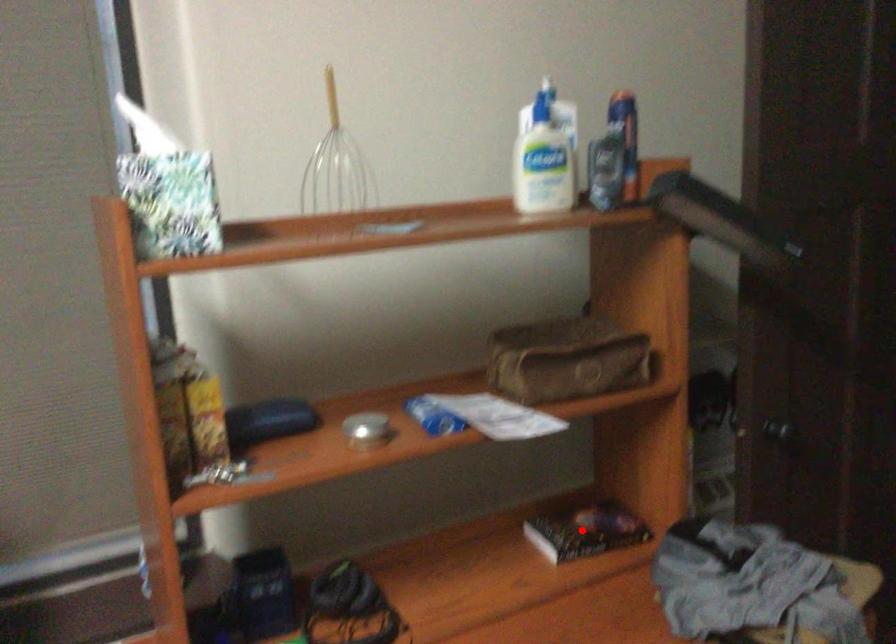
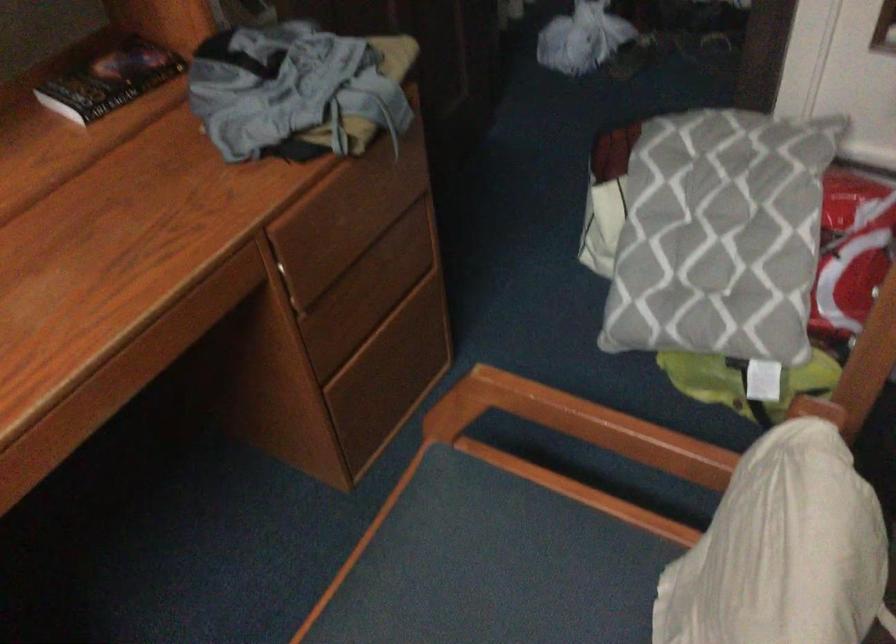
In the second image, find the point that corresponds to the highlighted location in the first image.

(110, 80)